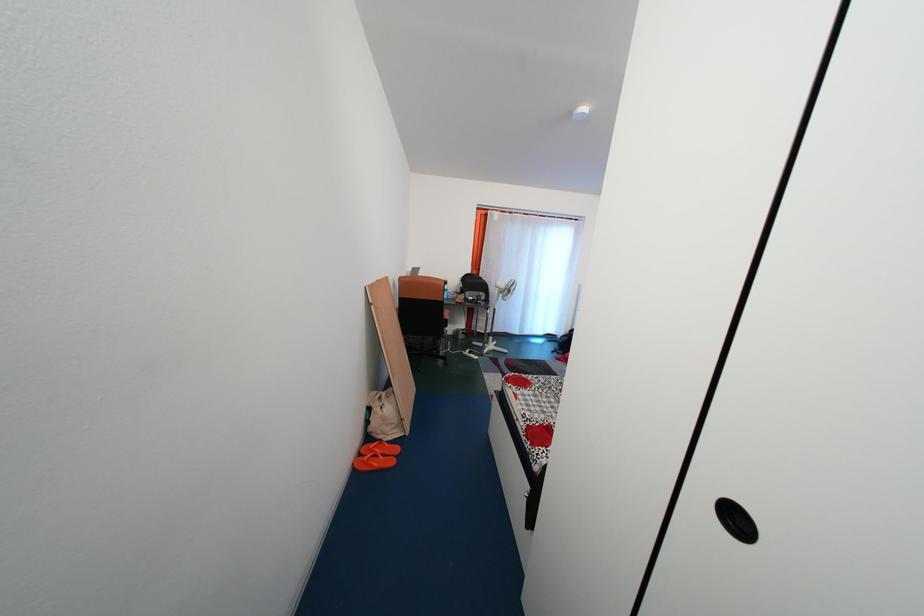
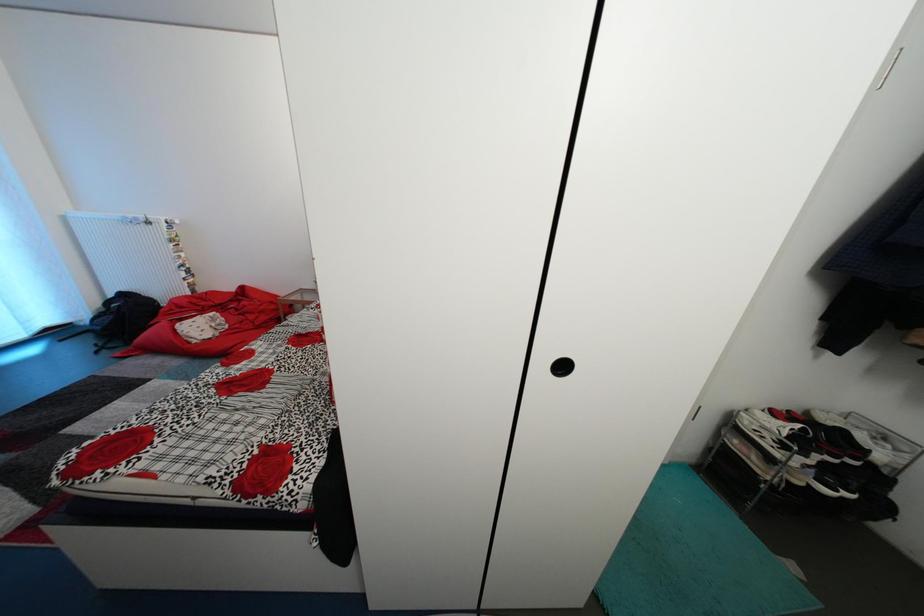
How did the camera likely rotate?

The camera rotated toward right-down.